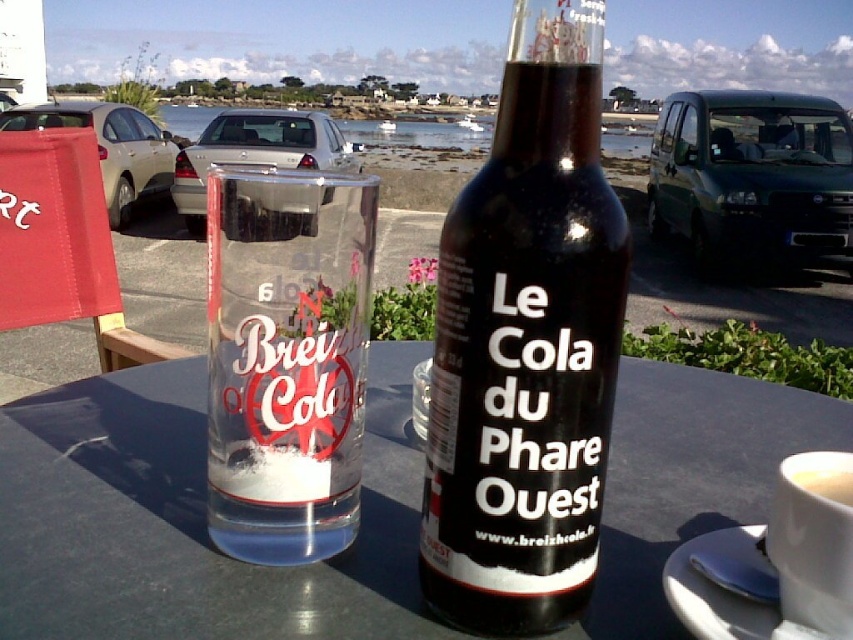
Can you confirm if black glass bottle at center is thinner than clear glass cup at center?

Correct, black glass bottle at center's width is less than clear glass cup at center's.

Which is above, black glass bottle at center or clear glass cup at center?

Positioned higher is clear glass cup at center.

The width and height of the screenshot is (853, 640). I want to click on black glass bottle at center, so click(526, 344).

In order to click on black glass bottle at center in this screenshot , I will do `click(526, 344)`.

Does transparent glass at center have a lesser width compared to white ceramic saucer at lower right?

No, transparent glass at center is not thinner than white ceramic saucer at lower right.

Is transparent glass at center taller than white ceramic saucer at lower right?

Correct, transparent glass at center is much taller as white ceramic saucer at lower right.

At what (x,y) coordinates should I click in order to perform the action: click on transparent glass at center. Please return your answer as a coordinate pair (x, y). Looking at the image, I should click on (189, 520).

Is white ceramic saucer at lower right behind white matte cup at upper right?

Yes, white ceramic saucer at lower right is further from the viewer.

Is point (850, 630) positioned after point (825, 484)?

No, (850, 630) is in front of (825, 484).

Locate an element on the screen. This screenshot has width=853, height=640. white ceramic saucer at lower right is located at coordinates (728, 593).